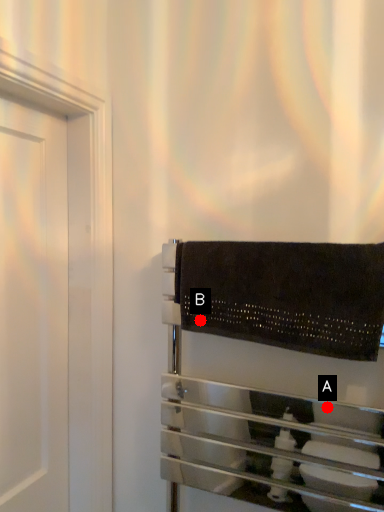
Question: Two points are circled on the image, labeled by A and B beside each circle. Which of the following is the farthest from the observer?

Choices:
 (A) A is further
 (B) B is further

Answer: (A)